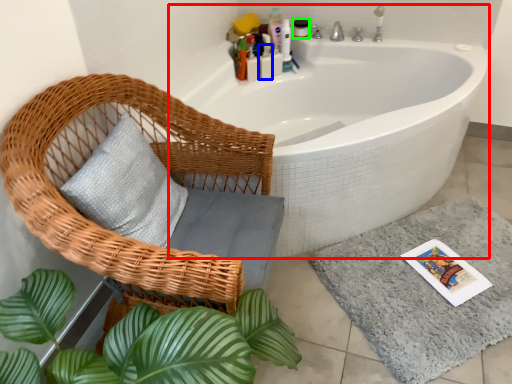
Question: Based on their relative distances, which object is farther from bathtub (highlighted by a red box)? Choose from toiletry (highlighted by a blue box) and toiletry (highlighted by a green box).

Choices:
 (A) toiletry
 (B) toiletry

Answer: (B)